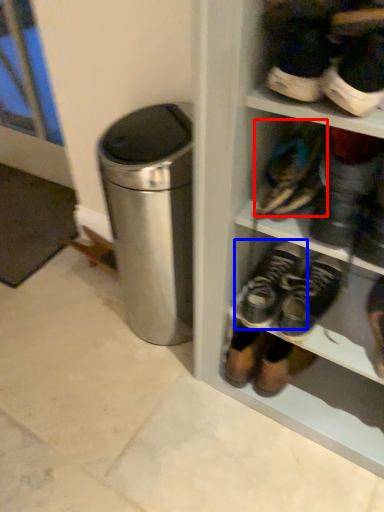
Question: Among these objects, which one is farthest to the camera, footwear (highlighted by a red box) or footwear (highlighted by a blue box)?

Choices:
 (A) footwear
 (B) footwear

Answer: (B)